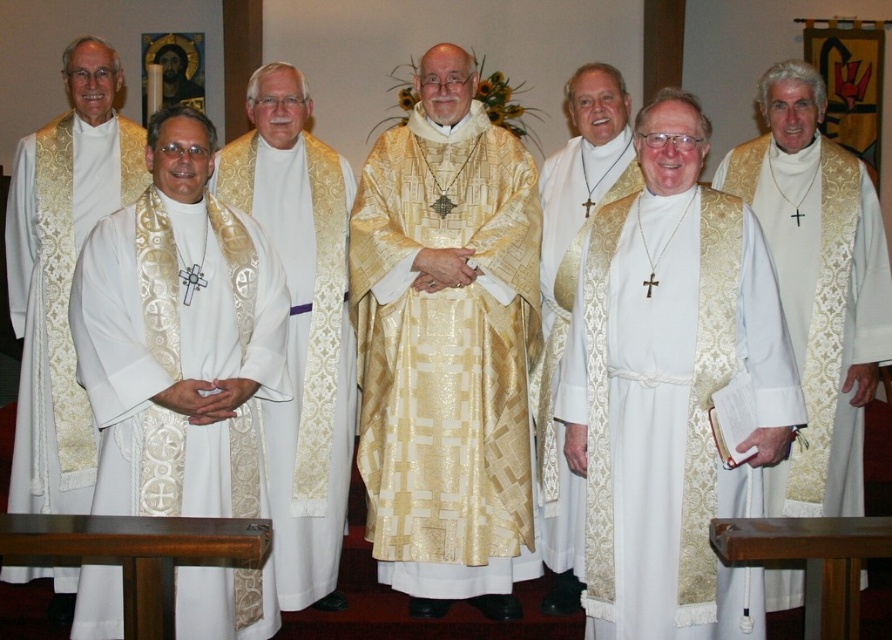
You are an architect designing a new church layout. You need to place a large chandelier directly above the gold textured robe at center. According to the image, what are the coordinates where you should position the chandelier?

The gold textured robe at center is located at coordinates point (446, 355), so the chandelier should be placed directly above this point.